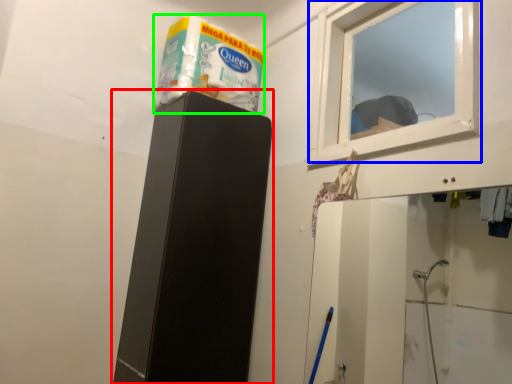
Question: Estimate the real-world distances between objects in this image. Which object is closer to furniture (highlighted by a red box), window (highlighted by a blue box) or product (highlighted by a green box)?

Choices:
 (A) window
 (B) product

Answer: (B)